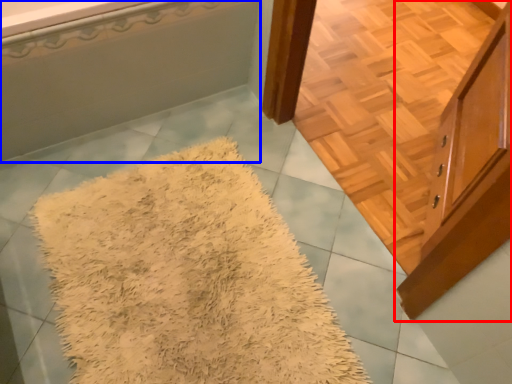
Question: Which object appears closest to the camera in this image, cabinetry (highlighted by a red box) or bathtub (highlighted by a blue box)?

Choices:
 (A) cabinetry
 (B) bathtub

Answer: (A)